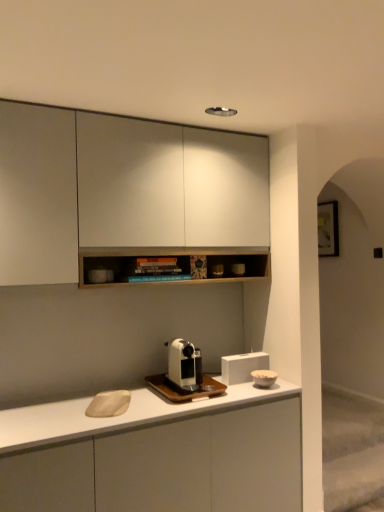
The image size is (384, 512). I want to click on porcelain bowl at right, which ranks as the 1th appliance in front-to-back order, so click(264, 377).

This screenshot has height=512, width=384. What do you see at coordinates (242, 366) in the screenshot? I see `white matte speaker at center, the 2th appliance from the front` at bounding box center [242, 366].

Describe the element at coordinates (120, 189) in the screenshot. I see `white matte cabinet at upper center, the second cabinetry in the bottom-to-top sequence` at that location.

Identify the location of white glossy coffee machine at center, the first coffee machine when ordered from top to bottom. This screenshot has width=384, height=512. (184, 364).

Locate an element on the screen. the 1st appliance behind the white glossy coffee machine at center, which is the 2th coffee machine in top-to-bottom order is located at coordinates coord(264,377).

Consider the image. Who is bigger, white glossy coffee machine at center, which is the 2th coffee machine in top-to-bottom order, or porcelain bowl at right, the second appliance viewed from the back?

With larger size is white glossy coffee machine at center, which is the 2th coffee machine in top-to-bottom order.

Is white glossy coffee machine at center, which is the 2th coffee machine in top-to-bottom order, looking in the opposite direction of porcelain bowl at right, the second appliance viewed from the back?

No, white glossy coffee machine at center, which is the 2th coffee machine in top-to-bottom order, is not facing the opposite direction of porcelain bowl at right, the second appliance viewed from the back.

Who is taller, white glossy coffee machine at center, which is the 2th coffee machine in top-to-bottom order, or porcelain bowl at right, which ranks as the 1th appliance in front-to-back order?

porcelain bowl at right, which ranks as the 1th appliance in front-to-back order, is taller.

In the scene shown: Considering the sizes of white glossy coffee machine at center, which is counted as the 2th coffee machine, starting from the bottom, and white matte cabinet at center, marked as the 1th cabinetry in a bottom-to-top arrangement, in the image, is white glossy coffee machine at center, which is counted as the 2th coffee machine, starting from the bottom, wider or thinner than white matte cabinet at center, marked as the 1th cabinetry in a bottom-to-top arrangement,?

Clearly, white glossy coffee machine at center, which is counted as the 2th coffee machine, starting from the bottom, has less width compared to white matte cabinet at center, marked as the 1th cabinetry in a bottom-to-top arrangement.

The width and height of the screenshot is (384, 512). Find the location of `cabinetry that is the 2nd object located in front of the white glossy coffee machine at center, which is counted as the 2th coffee machine, starting from the bottom`. cabinetry that is the 2nd object located in front of the white glossy coffee machine at center, which is counted as the 2th coffee machine, starting from the bottom is located at coordinates (168, 466).

Is white matte cabinet at center, marked as the 1th cabinetry in a bottom-to-top arrangement, located within white glossy coffee machine at center, the first coffee machine when ordered from top to bottom?

Definitely not — white matte cabinet at center, marked as the 1th cabinetry in a bottom-to-top arrangement, is not inside white glossy coffee machine at center, the first coffee machine when ordered from top to bottom.

Does point (188, 355) appear closer or farther from the camera than point (266, 481)?

Point (188, 355) is farther from the camera than point (266, 481).

Consider the image. From the image's perspective, which one is positioned lower, white glossy coffee machine at center, which is counted as the 2th coffee machine, starting from the bottom, or white matte cabinet at upper center, the second cabinetry in the bottom-to-top sequence?

white glossy coffee machine at center, which is counted as the 2th coffee machine, starting from the bottom, appears lower in the image.

Does white glossy coffee machine at center, which is counted as the 2th coffee machine, starting from the bottom, have a smaller size compared to white matte cabinet at upper center, which appears as the first cabinetry when viewed from the top?

Indeed, white glossy coffee machine at center, which is counted as the 2th coffee machine, starting from the bottom, has a smaller size compared to white matte cabinet at upper center, which appears as the first cabinetry when viewed from the top.

Does white glossy coffee machine at center, which is counted as the 2th coffee machine, starting from the bottom, appear on the left side of white matte cabinet at upper center, the second cabinetry in the bottom-to-top sequence?

No, white glossy coffee machine at center, which is counted as the 2th coffee machine, starting from the bottom, is not to the left of white matte cabinet at upper center, the second cabinetry in the bottom-to-top sequence.

What's the angular difference between white glossy coffee machine at center, the first coffee machine when ordered from top to bottom, and white matte cabinet at upper center, the second cabinetry in the bottom-to-top sequence,'s facing directions?

There is a 0.0057-degree angle between the facing directions of white glossy coffee machine at center, the first coffee machine when ordered from top to bottom, and white matte cabinet at upper center, the second cabinetry in the bottom-to-top sequence.

Which object is positioned more to the left, white matte cabinet at center, marked as the 1th cabinetry in a bottom-to-top arrangement, or white matte speaker at center, the 2th appliance from the front?

white matte cabinet at center, marked as the 1th cabinetry in a bottom-to-top arrangement.

Can you confirm if white matte cabinet at center, which is the second cabinetry from top to bottom, is thinner than white matte speaker at center, the 2th appliance from the front?

No, white matte cabinet at center, which is the second cabinetry from top to bottom, is not thinner than white matte speaker at center, the 2th appliance from the front.

Is white matte speaker at center, the 1th appliance viewed from the back, located within white matte cabinet at center, which is the second cabinetry from top to bottom?

No, white matte speaker at center, the 1th appliance viewed from the back, is not surrounded by white matte cabinet at center, which is the second cabinetry from top to bottom.

Does white matte cabinet at center, marked as the 1th cabinetry in a bottom-to-top arrangement, come behind white glossy coffee machine at center, which is the 2th coffee machine in top-to-bottom order?

No, it is in front of white glossy coffee machine at center, which is the 2th coffee machine in top-to-bottom order.

Could you tell me if white matte cabinet at center, marked as the 1th cabinetry in a bottom-to-top arrangement, is facing white glossy coffee machine at center, which is the 2th coffee machine in top-to-bottom order?

No, white matte cabinet at center, marked as the 1th cabinetry in a bottom-to-top arrangement, is not aimed at white glossy coffee machine at center, which is the 2th coffee machine in top-to-bottom order.

Which is closer, (109, 445) or (200, 354)?

Clearly, point (109, 445) is closer to the camera than point (200, 354).

Can you tell me how much white matte cabinet at center, marked as the 1th cabinetry in a bottom-to-top arrangement, and white glossy coffee machine at center, placed as the first coffee machine when sorted from bottom to top, differ in facing direction?

The angular difference between white matte cabinet at center, marked as the 1th cabinetry in a bottom-to-top arrangement, and white glossy coffee machine at center, placed as the first coffee machine when sorted from bottom to top, is 0.000769 degrees.

Is white glossy coffee machine at center, which is counted as the 2th coffee machine, starting from the bottom, located outside white matte speaker at center, the 2th appliance from the front?

Yes, white glossy coffee machine at center, which is counted as the 2th coffee machine, starting from the bottom, is located beyond the bounds of white matte speaker at center, the 2th appliance from the front.

Is there a large distance between white glossy coffee machine at center, the first coffee machine when ordered from top to bottom, and white matte speaker at center, the 2th appliance from the front?

No, there isn't a large distance between white glossy coffee machine at center, the first coffee machine when ordered from top to bottom, and white matte speaker at center, the 2th appliance from the front.

Is white glossy coffee machine at center, which is counted as the 2th coffee machine, starting from the bottom, oriented away from white matte speaker at center, the 2th appliance from the front?

No, white glossy coffee machine at center, which is counted as the 2th coffee machine, starting from the bottom, is not facing away from white matte speaker at center, the 2th appliance from the front.

Which object is further away from the camera, porcelain bowl at right, which ranks as the 1th appliance in front-to-back order, or white matte cabinet at upper center, the second cabinetry in the bottom-to-top sequence?

porcelain bowl at right, which ranks as the 1th appliance in front-to-back order.

Looking at the image, does porcelain bowl at right, which ranks as the 1th appliance in front-to-back order, seem bigger or smaller compared to white matte cabinet at upper center, which appears as the first cabinetry when viewed from the top?

porcelain bowl at right, which ranks as the 1th appliance in front-to-back order, is smaller than white matte cabinet at upper center, which appears as the first cabinetry when viewed from the top.

In the image, is porcelain bowl at right, which ranks as the 1th appliance in front-to-back order, on the left side or the right side of white matte cabinet at upper center, which appears as the first cabinetry when viewed from the top?

porcelain bowl at right, which ranks as the 1th appliance in front-to-back order, is positioned on white matte cabinet at upper center, which appears as the first cabinetry when viewed from the top,'s right side.

Locate an element on the screen. This screenshot has height=512, width=384. the 1st appliance behind when counting from the white matte cabinet at upper center, the second cabinetry in the bottom-to-top sequence is located at coordinates (264, 377).

This screenshot has width=384, height=512. What are the coordinates of `coffee machine below the porcelain bowl at right, the second appliance viewed from the back (from a real-world perspective)` in the screenshot? It's located at (184, 375).

At what (x,y) coordinates should I click in order to perform the action: click on the 2nd coffee machine behind when counting from the white matte cabinet at center, marked as the 1th cabinetry in a bottom-to-top arrangement. Please return your answer as a coordinate pair (x, y). This screenshot has width=384, height=512. Looking at the image, I should click on pos(184,364).

Which object lies nearer to the anchor point white matte speaker at center, the 1th appliance viewed from the back, white glossy coffee machine at center, the first coffee machine when ordered from top to bottom, or porcelain bowl at right, which ranks as the 1th appliance in front-to-back order?

The object closer to white matte speaker at center, the 1th appliance viewed from the back, is porcelain bowl at right, which ranks as the 1th appliance in front-to-back order.

When comparing their distances from white glossy coffee machine at center, which is counted as the 2th coffee machine, starting from the bottom, does white matte speaker at center, the 1th appliance viewed from the back, or porcelain bowl at right, the second appliance viewed from the back, seem further?

Based on the image, porcelain bowl at right, the second appliance viewed from the back, appears to be further to white glossy coffee machine at center, which is counted as the 2th coffee machine, starting from the bottom.

Estimate the real-world distances between objects in this image. Which object is closer to white matte cabinet at center, which is the second cabinetry from top to bottom, porcelain bowl at right, the second appliance viewed from the back, or white matte speaker at center, the 1th appliance viewed from the back?

white matte speaker at center, the 1th appliance viewed from the back.

Looking at the image, which one is located further to white matte speaker at center, the 1th appliance viewed from the back, white glossy coffee machine at center, the first coffee machine when ordered from top to bottom, or white matte cabinet at center, marked as the 1th cabinetry in a bottom-to-top arrangement?

white matte cabinet at center, marked as the 1th cabinetry in a bottom-to-top arrangement, lies further to white matte speaker at center, the 1th appliance viewed from the back, than the other object.

From the image, which object appears to be nearer to white matte cabinet at center, marked as the 1th cabinetry in a bottom-to-top arrangement, porcelain bowl at right, the second appliance viewed from the back, or white glossy coffee machine at center, which is the 2th coffee machine in top-to-bottom order?

white glossy coffee machine at center, which is the 2th coffee machine in top-to-bottom order, is positioned closer to the anchor white matte cabinet at center, marked as the 1th cabinetry in a bottom-to-top arrangement.

Which object lies further to the anchor point white matte speaker at center, the 2th appliance from the front, white matte cabinet at center, which is the second cabinetry from top to bottom, or white glossy coffee machine at center, which is the 2th coffee machine in top-to-bottom order?

white matte cabinet at center, which is the second cabinetry from top to bottom.

Which object lies nearer to the anchor point white glossy coffee machine at center, which is counted as the 2th coffee machine, starting from the bottom, porcelain bowl at right, the second appliance viewed from the back, or white matte cabinet at center, which is the second cabinetry from top to bottom?

The object closer to white glossy coffee machine at center, which is counted as the 2th coffee machine, starting from the bottom, is porcelain bowl at right, the second appliance viewed from the back.

From the image, which object appears to be farther from porcelain bowl at right, the second appliance viewed from the back, white glossy coffee machine at center, the first coffee machine when ordered from top to bottom, or white matte cabinet at upper center, the second cabinetry in the bottom-to-top sequence?

white matte cabinet at upper center, the second cabinetry in the bottom-to-top sequence.

At what (x,y) coordinates should I click in order to perform the action: click on appliance situated between white glossy coffee machine at center, which is the 2th coffee machine in top-to-bottom order, and porcelain bowl at right, the second appliance viewed from the back, from left to right. Please return your answer as a coordinate pair (x, y). Looking at the image, I should click on (242, 366).

I want to click on coffee machine situated between white glossy coffee machine at center, the first coffee machine when ordered from top to bottom, and porcelain bowl at right, the second appliance viewed from the back, from left to right, so click(184, 375).

Locate an element on the screen. coffee machine positioned between white matte cabinet at center, which is the second cabinetry from top to bottom, and white glossy coffee machine at center, which is counted as the 2th coffee machine, starting from the bottom, from near to far is located at coordinates (184, 375).

The height and width of the screenshot is (512, 384). I want to click on appliance located between white glossy coffee machine at center, the first coffee machine when ordered from top to bottom, and porcelain bowl at right, which ranks as the 1th appliance in front-to-back order, in the left-right direction, so click(242, 366).